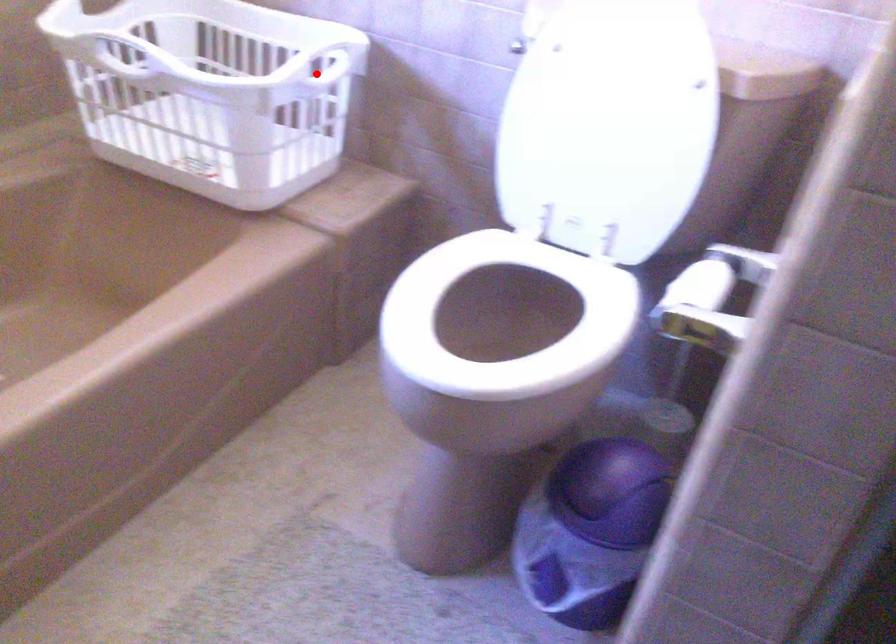
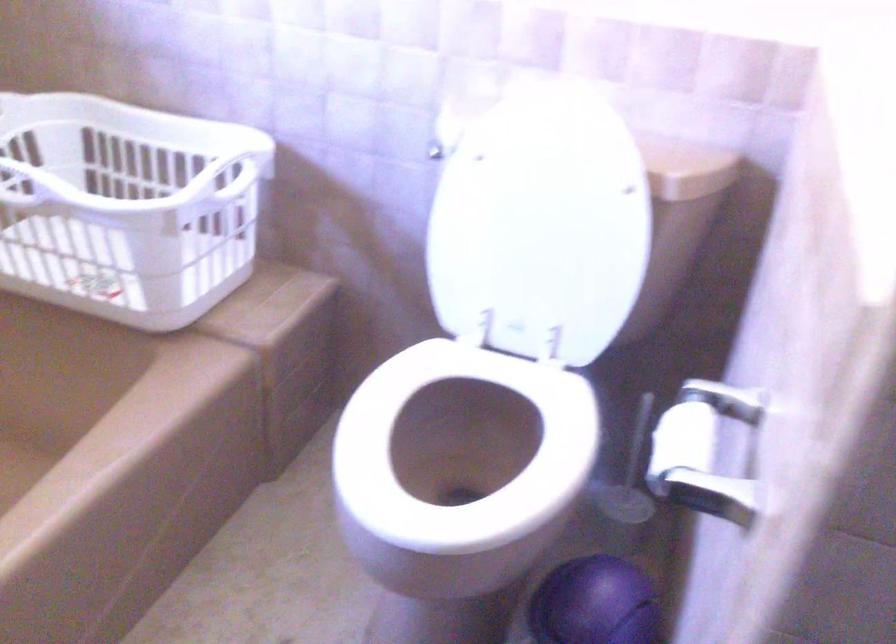
Locate, in the second image, the point that corresponds to the highlighted location in the first image.

(222, 178)